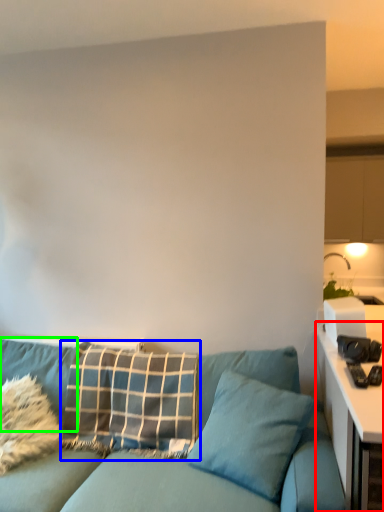
Question: Which object is the farthest from table (highlighted by a red box)? Choose among these: pillow (highlighted by a blue box) or pillow (highlighted by a green box).

Choices:
 (A) pillow
 (B) pillow

Answer: (B)